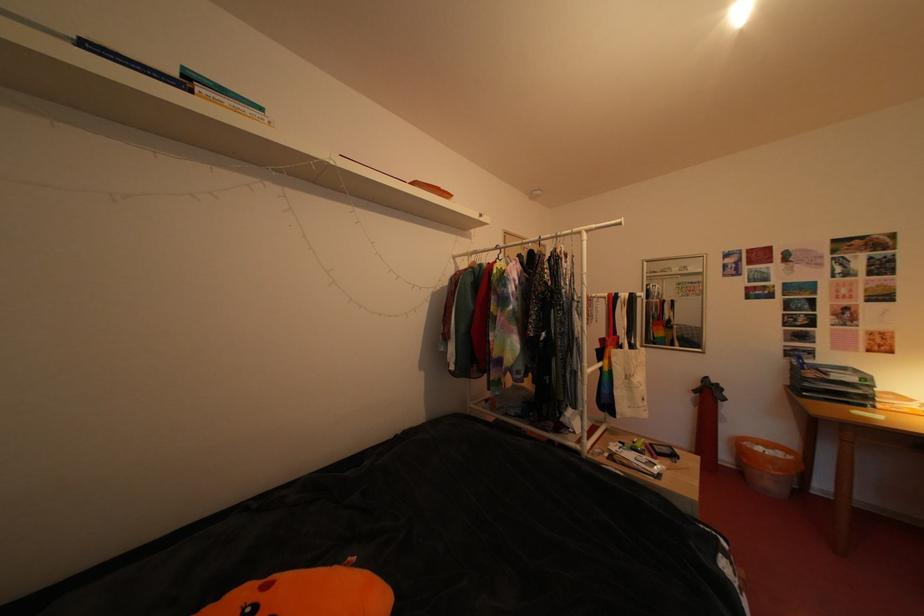
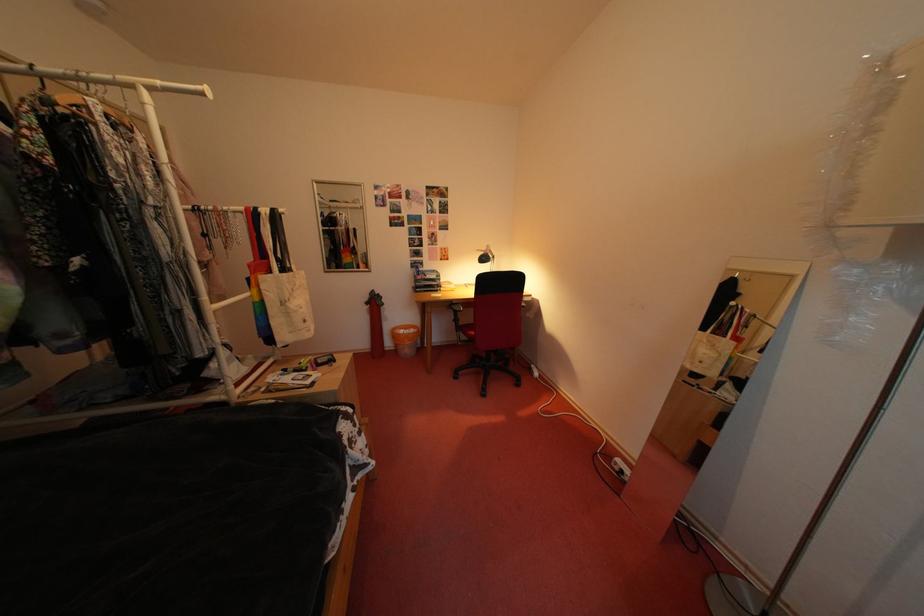
Find the pixel in the second image that matches [621,377] in the first image.

(273, 306)